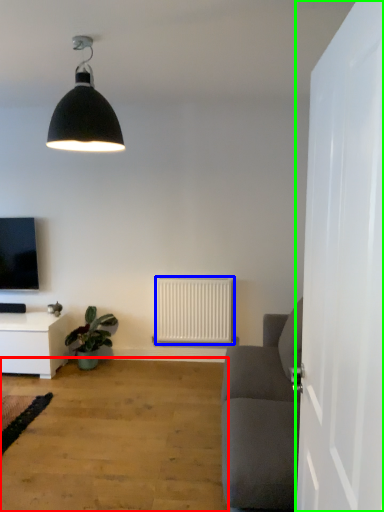
Question: Which object is the closest to the plain (highlighted by a red box)? Choose among these: radiator (highlighted by a blue box) or door (highlighted by a green box).

Choices:
 (A) radiator
 (B) door

Answer: (A)